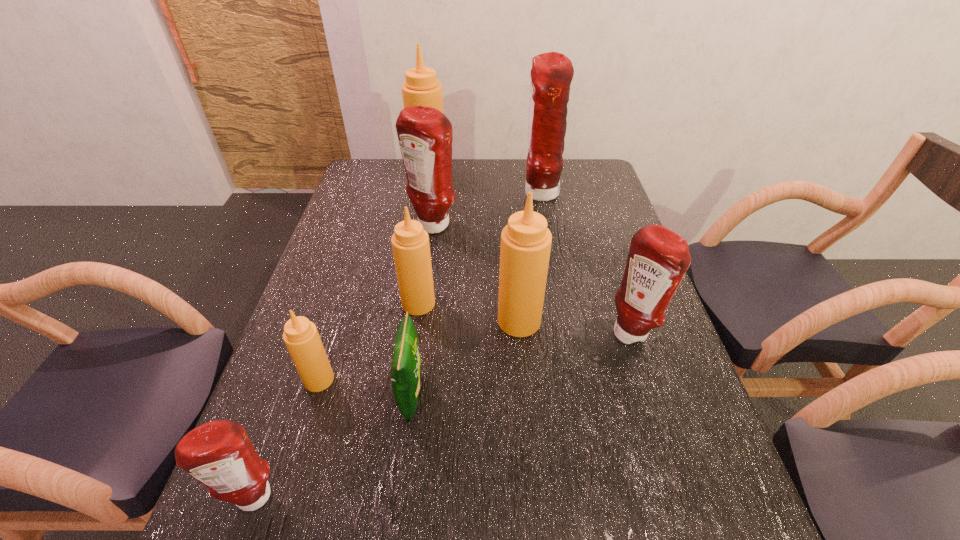
What are the coordinates of `the farthest tan condiment` in the screenshot? It's located at (421, 88).

Locate an element on the screen. the biggest red condiment is located at coordinates (551, 75).

The height and width of the screenshot is (540, 960). In order to click on the farthest red condiment in this screenshot , I will do `click(551, 75)`.

At what (x,y) coordinates should I click in order to perform the action: click on the second biggest tan condiment. Please return your answer as a coordinate pair (x, y). The height and width of the screenshot is (540, 960). Looking at the image, I should click on click(525, 248).

This screenshot has width=960, height=540. What are the coordinates of `the sixth nearest condiment` in the screenshot? It's located at (425, 134).

This screenshot has width=960, height=540. I want to click on the third nearest red condiment, so click(425, 134).

Identify the location of the second smallest tan condiment. (410, 242).

Locate an element on the screen. This screenshot has width=960, height=540. the second smallest red condiment is located at coordinates (658, 259).

Image resolution: width=960 pixels, height=540 pixels. I want to click on the rightmost red condiment, so click(658, 259).

The width and height of the screenshot is (960, 540). Find the location of `the nearest condiment`. the nearest condiment is located at coordinates (219, 454).